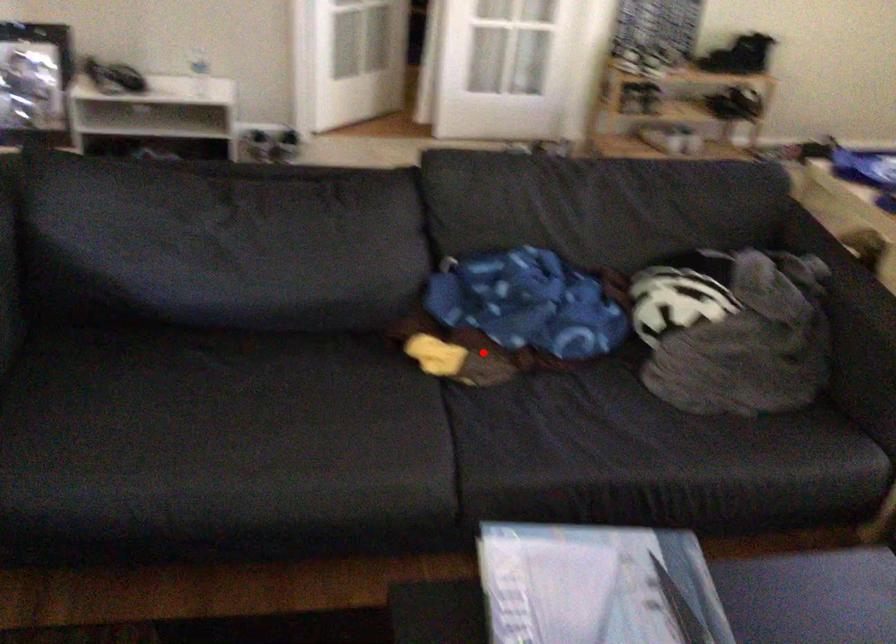
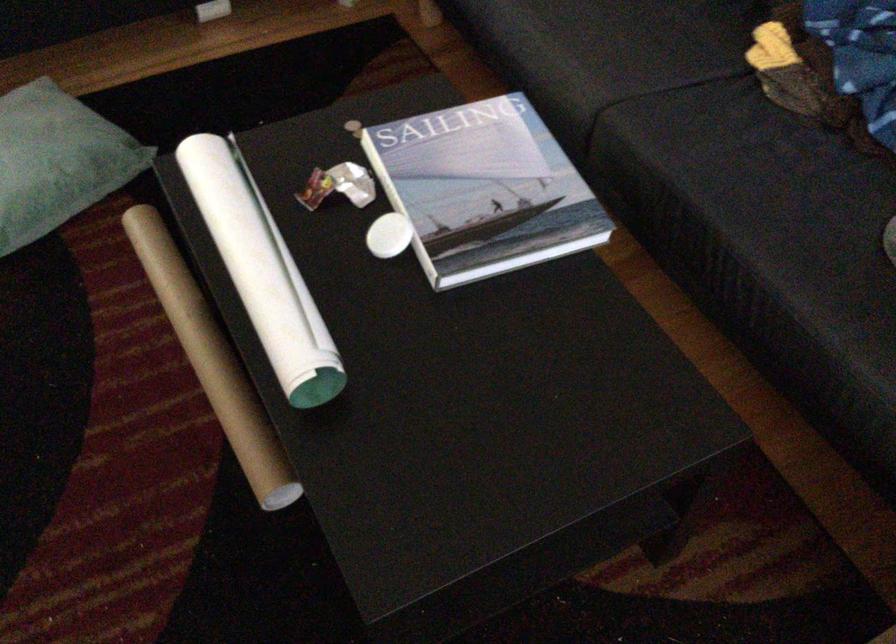
Question: I am providing you with two images of the same scene from different viewpoints. In image1, a red point is highlighted. Considering the same 3D point in image2, which of the following is correct?

Choices:
 (A) It is closer
 (B) It is farther

Answer: (A)